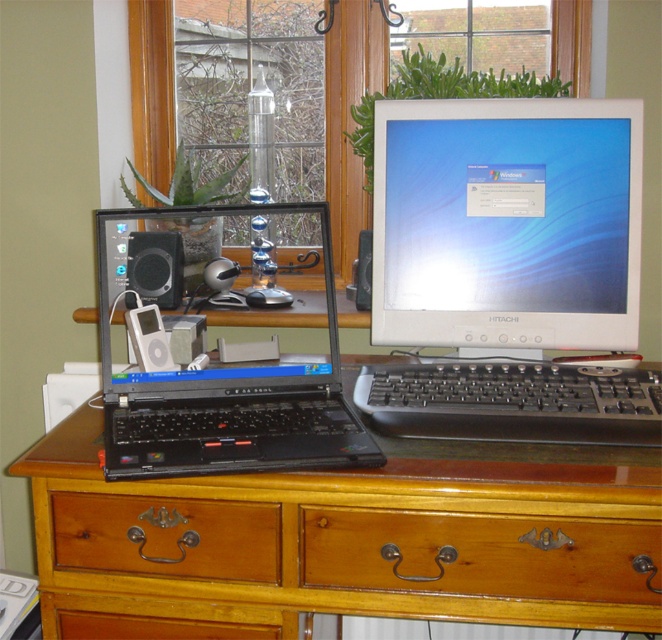
Question: Can you confirm if white glossy monitor at center is positioned below brown wood drawer at lower left?

Choices:
 (A) no
 (B) yes

Answer: (A)

Question: Which of the following is the farthest from the observer?

Choices:
 (A) silver metallic ipod at center
 (B) transparent glass window at upper center
 (C) brown wood drawer at lower left

Answer: (B)

Question: Considering the real-world distances, which object is farthest from the silver metallic ipod at center?

Choices:
 (A) black plastic keyboard at center
 (B) black plastic laptop at left
 (C) brown wood computer desk at center
 (D) black plastic speaker at center

Answer: (A)

Question: Can you confirm if black plastic laptop at left is wider than black plastic speaker at center?

Choices:
 (A) yes
 (B) no

Answer: (A)

Question: Which point is farther to the camera?

Choices:
 (A) (128, 305)
 (B) (487, 113)
 (C) (132, 340)
 (D) (205, 506)

Answer: (A)

Question: Is black plastic laptop at left further to camera compared to matte black speaker at left?

Choices:
 (A) no
 (B) yes

Answer: (A)